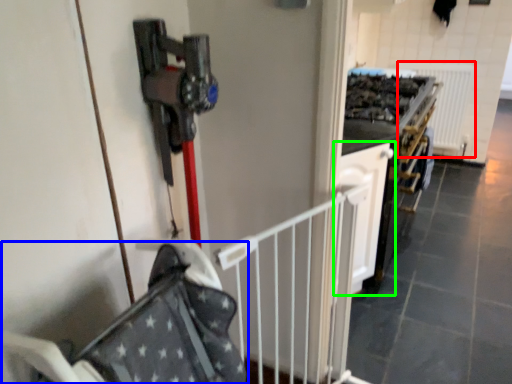
Question: Estimate the real-world distances between objects in this image. Which object is closer to radiator (highlighted by a red box), baby carriage (highlighted by a blue box) or cabinetry (highlighted by a green box)?

Choices:
 (A) baby carriage
 (B) cabinetry

Answer: (B)